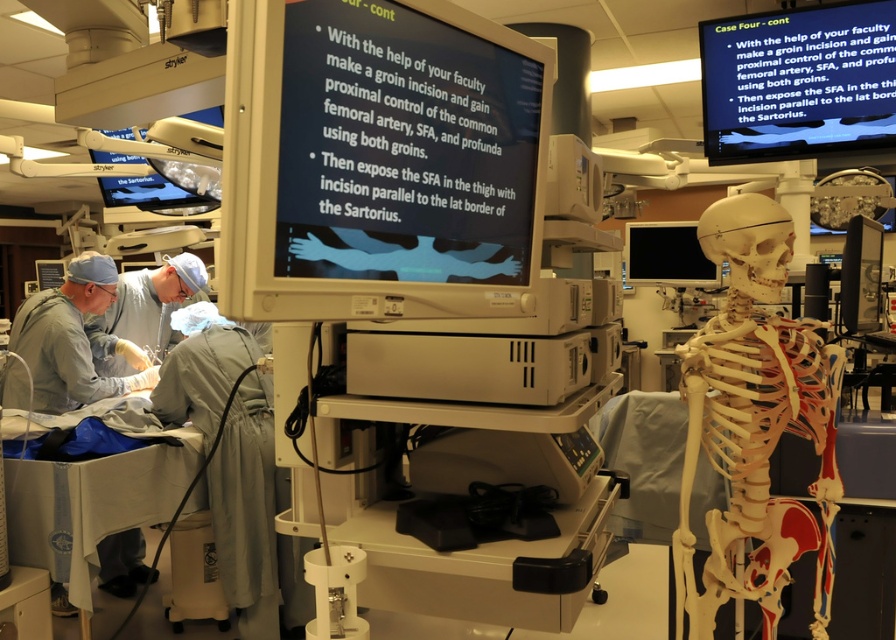
You are a medical student in the surgical simulation lab. You need to refer to both the matte black monitor at upper center and the black glossy monitor at center. Which monitor has a greater width?

The matte black monitor at upper center has a greater width than the black glossy monitor at center.

You are a medical student standing in the surgical simulation lab. You need to locate the matte plastic monitor at center to view the instructional text. Where should you look in the lab to find it?

A: The matte plastic monitor at center is located at the 2D coordinates point (378, 161) in the lab, so you should look there to view the instructional text.